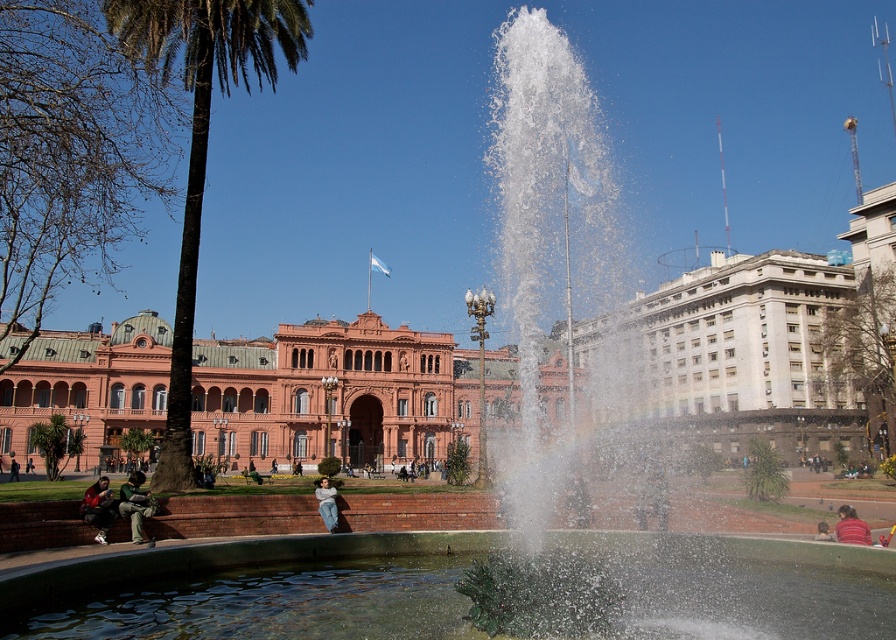
Does green leafy palm tree at left have a larger size compared to green fabric jacket at lower left?

Yes.

Who is more forward, [181,298] or [130,484]?

Point [130,484]

Find the location of a particular element. The image size is (896, 640). green leafy palm tree at left is located at coordinates (201, 140).

Can you confirm if green fabric jacket at lower left is shorter than denim jeans at lower center?

No, green fabric jacket at lower left is not shorter than denim jeans at lower center.

Between green fabric jacket at lower left and denim jeans at lower center, which one has less height?

denim jeans at lower center is shorter.

Does point (125, 506) come behind point (326, 515)?

No, it is in front of (326, 515).

Locate an element on the screen. green fabric jacket at lower left is located at coordinates (135, 502).

Is point (138, 536) positioned behind point (16, 464)?

No, it is in front of (16, 464).

Which is below, green fabric jacket at lower left or dark green fabric jacket at lower left?

Positioned lower is green fabric jacket at lower left.

Is point (156, 508) positioned behind point (13, 465)?

No.

I want to click on green fabric jacket at lower left, so click(135, 502).